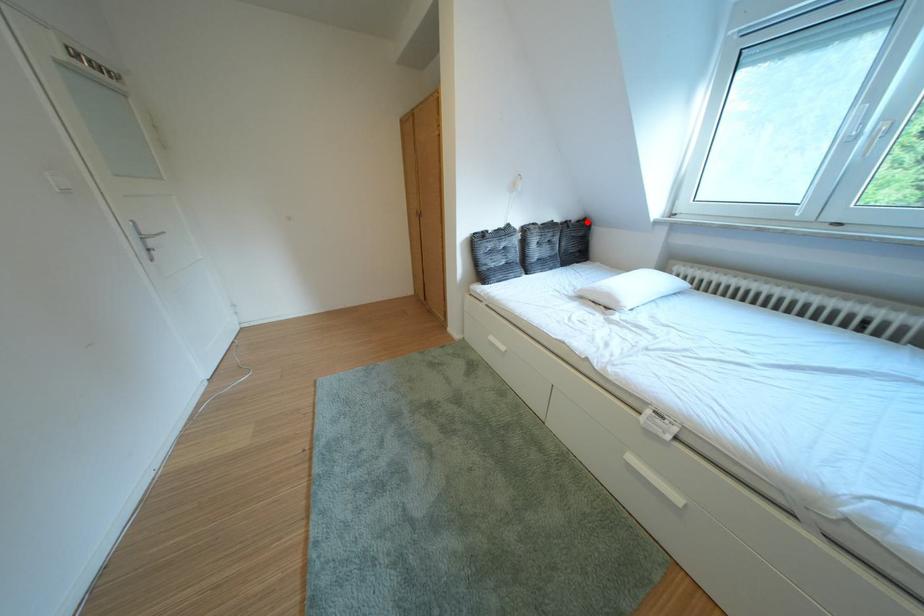
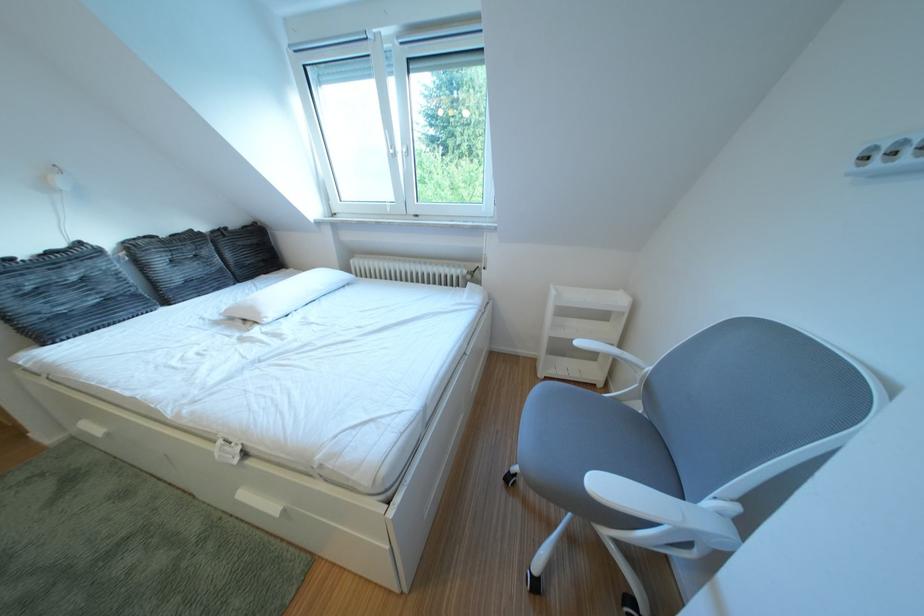
Where in the second image is the point corresponding to the highlighted location from the first image?

(247, 228)